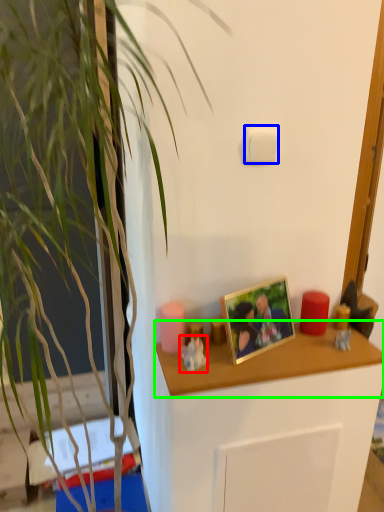
Question: Based on their relative distances, which object is farther from toy (highlighted by a red box)? Choose from light switch (highlighted by a blue box) and desk (highlighted by a green box).

Choices:
 (A) light switch
 (B) desk

Answer: (A)